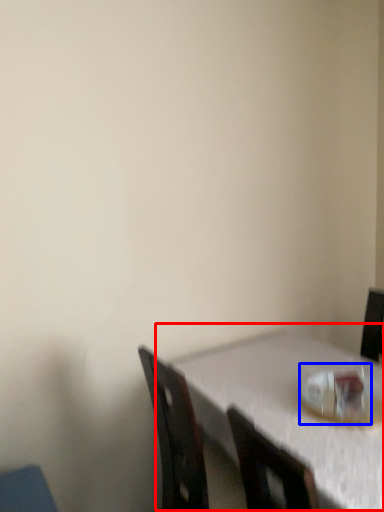
Question: Which of the following is the closest to the observer, table (highlighted by a red box) or tableware (highlighted by a blue box)?

Choices:
 (A) table
 (B) tableware

Answer: (A)